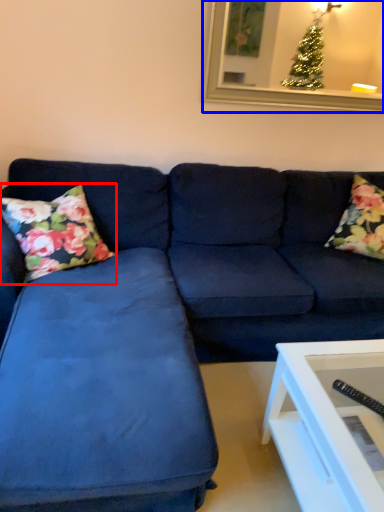
Question: Among these objects, which one is nearest to the camera, pillow (highlighted by a red box) or picture frame (highlighted by a blue box)?

Choices:
 (A) pillow
 (B) picture frame

Answer: (A)